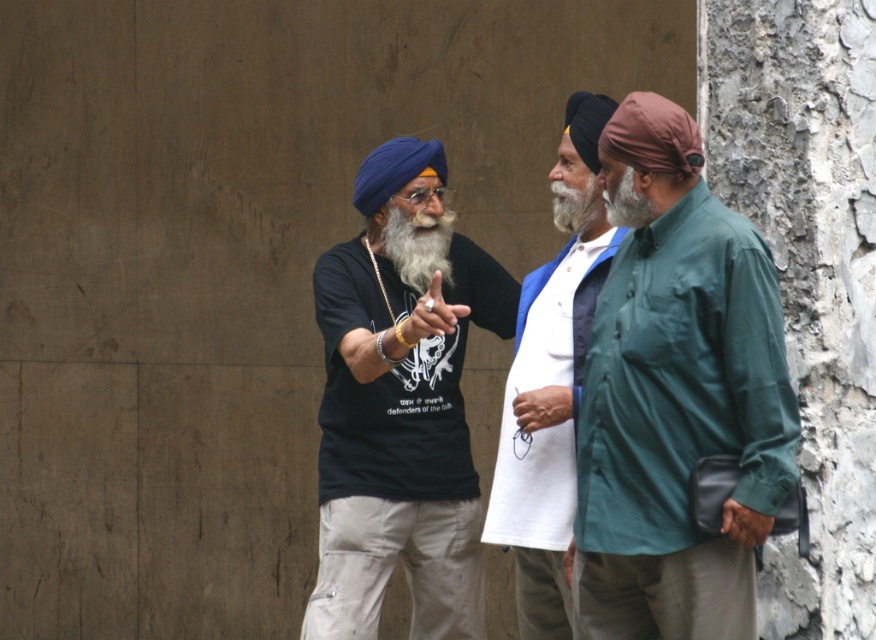
Which is more to the right, green fabric shirt at right or matte black t-shirt at center?

From the viewer's perspective, green fabric shirt at right appears more on the right side.

Identify the location of green fabric shirt at right. (676, 396).

You are a GUI agent. You are given a task and a screenshot of the screen. Output one action in this format:
    pyautogui.click(x=<x>, y=<y>)
    Task: Click on the green fabric shirt at right
    
    Given the screenshot: What is the action you would take?
    pyautogui.click(x=676, y=396)

Can you confirm if green fabric shirt at right is positioned to the right of white cotton shirt at center?

Yes, green fabric shirt at right is to the right of white cotton shirt at center.

Which is in front, point (732, 580) or point (521, 609)?

Point (732, 580)

Does point (633, 305) come closer to viewer compared to point (526, 276)?

Yes, point (633, 305) is closer to viewer.

Where is `green fabric shirt at right`? Image resolution: width=876 pixels, height=640 pixels. green fabric shirt at right is located at coordinates (676, 396).

What do you see at coordinates (400, 403) in the screenshot?
I see `matte black t-shirt at center` at bounding box center [400, 403].

What do you see at coordinates (400, 403) in the screenshot? I see `matte black t-shirt at center` at bounding box center [400, 403].

Identify the location of matte black t-shirt at center. The height and width of the screenshot is (640, 876). (400, 403).